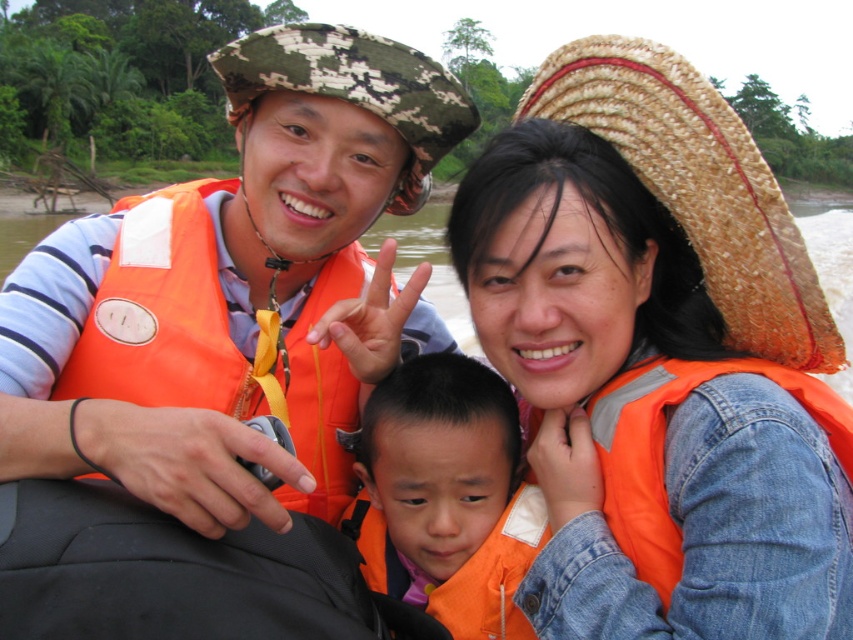
Is orange life vest at upper right to the left of orange life jacket at left from the viewer's perspective?

No, orange life vest at upper right is not to the left of orange life jacket at left.

Who is more distant from viewer, (x=610, y=273) or (x=184, y=276)?

The point (x=184, y=276) is behind.

Locate an element on the screen. This screenshot has height=640, width=853. orange life vest at upper right is located at coordinates (646, 410).

Does strawmaterial/texturehat at upper right have a greater width compared to orange life vest at center?

Yes.

Who is lower down, strawmaterial/texturehat at upper right or orange life vest at center?

orange life vest at center is lower down.

Between point (627, 138) and point (450, 589), which one is positioned in front?

Point (627, 138) is more forward.

Locate an element on the screen. Image resolution: width=853 pixels, height=640 pixels. strawmaterial/texturehat at upper right is located at coordinates (698, 188).

Does orange life vest at upper right appear on the left side of orange life vest at center?

Incorrect, orange life vest at upper right is not on the left side of orange life vest at center.

Can you confirm if orange life vest at upper right is positioned to the right of orange life vest at center?

Correct, you'll find orange life vest at upper right to the right of orange life vest at center.

Is point (751, 580) closer to camera compared to point (518, 483)?

Yes.

Image resolution: width=853 pixels, height=640 pixels. I want to click on orange life vest at upper right, so click(646, 410).